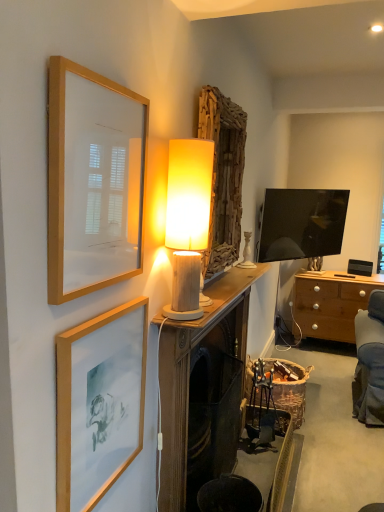
Question: Is wooden framed print at upper left, the 2th picture frame in the bottom-to-top sequence, outside of wooden mantlepiece at center?

Choices:
 (A) no
 (B) yes

Answer: (B)

Question: Is wooden framed print at upper left, arranged as the 1th picture frame when viewed from the top, far from wooden mantlepiece at center?

Choices:
 (A) yes
 (B) no

Answer: (B)

Question: Can you confirm if wooden framed print at upper left, the 2th picture frame in the bottom-to-top sequence, is smaller than wooden mantlepiece at center?

Choices:
 (A) no
 (B) yes

Answer: (B)

Question: Is wooden framed print at upper left, arranged as the 1th picture frame when viewed from the top, shorter than wooden mantlepiece at center?

Choices:
 (A) no
 (B) yes

Answer: (B)

Question: Considering the relative sizes of wooden framed print at upper left, arranged as the 1th picture frame when viewed from the top, and wooden mantlepiece at center in the image provided, is wooden framed print at upper left, arranged as the 1th picture frame when viewed from the top, taller than wooden mantlepiece at center?

Choices:
 (A) no
 (B) yes

Answer: (A)

Question: Does wooden framed print at upper left, arranged as the 1th picture frame when viewed from the top, have a greater width compared to wooden mantlepiece at center?

Choices:
 (A) yes
 (B) no

Answer: (B)

Question: Is wooden cylindrical lamp at center next to metallic silver swivel chair at lower right and touching it?

Choices:
 (A) yes
 (B) no

Answer: (B)

Question: Can you confirm if wooden cylindrical lamp at center is wider than metallic silver swivel chair at lower right?

Choices:
 (A) no
 (B) yes

Answer: (A)

Question: Is wooden cylindrical lamp at center positioned with its back to metallic silver swivel chair at lower right?

Choices:
 (A) no
 (B) yes

Answer: (A)

Question: From the image's perspective, is wooden cylindrical lamp at center under metallic silver swivel chair at lower right?

Choices:
 (A) yes
 (B) no

Answer: (B)

Question: From a real-world perspective, is wooden cylindrical lamp at center below metallic silver swivel chair at lower right?

Choices:
 (A) no
 (B) yes

Answer: (A)

Question: From a real-world perspective, is wooden cylindrical lamp at center on metallic silver swivel chair at lower right?

Choices:
 (A) yes
 (B) no

Answer: (A)

Question: Considering the relative sizes of wooden framed print at upper left, arranged as the 1th picture frame when viewed from the top, and matte gold picture frame at lower left, which appears as the 2th picture frame when viewed from the top, in the image provided, is wooden framed print at upper left, arranged as the 1th picture frame when viewed from the top, shorter than matte gold picture frame at lower left, which appears as the 2th picture frame when viewed from the top,?

Choices:
 (A) no
 (B) yes

Answer: (A)